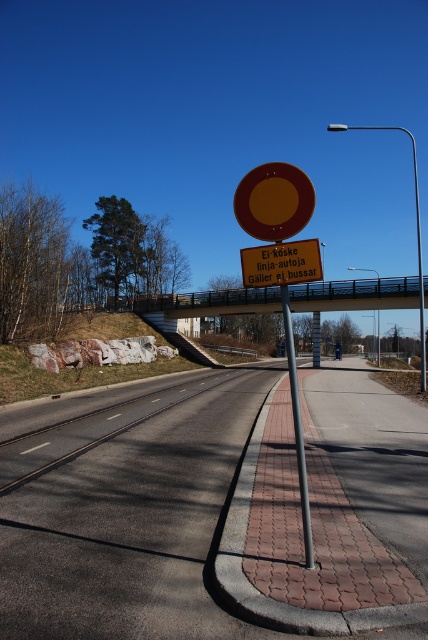
You are a delivery driver approaching the intersection and need to know if the yellow reflective circle at center is wider than the polished metal pole at center. Based on the scene, can you determine this?

The yellow reflective circle at center has a width less than the polished metal pole at center, so no, it is not wider than the polished metal pole at center.